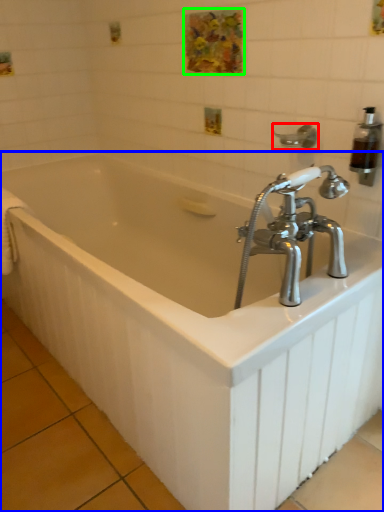
Question: Estimate the real-world distances between objects in this image. Which object is farther from shower (highlighted by a red box), bathtub (highlighted by a blue box) or art (highlighted by a green box)?

Choices:
 (A) bathtub
 (B) art

Answer: (A)